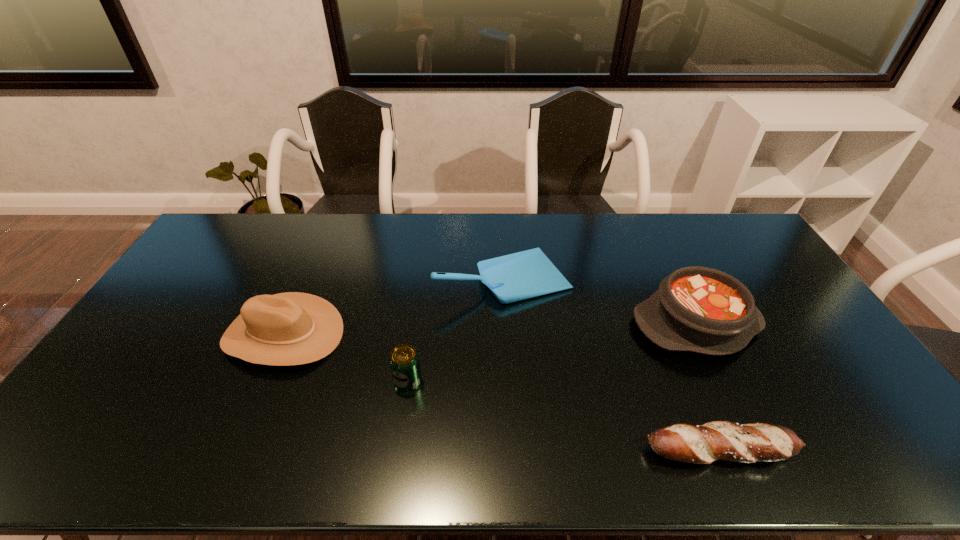
The height and width of the screenshot is (540, 960). What are the coordinates of `vacant space located 0.190m on the right of the shortest object` in the screenshot? It's located at (876, 450).

The image size is (960, 540). Identify the location of object that is at the far edge. (526, 274).

Identify the location of object located at the near edge. The image size is (960, 540). coord(717,440).

Locate an element on the screen. Image resolution: width=960 pixels, height=540 pixels. vacant region at the far edge of the desktop is located at coordinates (404, 218).

Where is `vacant space at the near edge of the desktop`? vacant space at the near edge of the desktop is located at coordinates (643, 451).

Image resolution: width=960 pixels, height=540 pixels. In order to click on vacant space at the far left corner of the desktop in this screenshot , I will do `click(219, 223)`.

In the image, there is a desktop. In order to click on vacant space at the far right corner in this screenshot , I will do `click(718, 230)`.

Find the location of a particular element. free space between the nearest object and the beer can is located at coordinates (564, 415).

This screenshot has width=960, height=540. I want to click on free point between the third object from left to right and the baguet, so click(x=612, y=363).

Identify the location of unoccupied position between the second object from left to right and the dustpan. (456, 329).